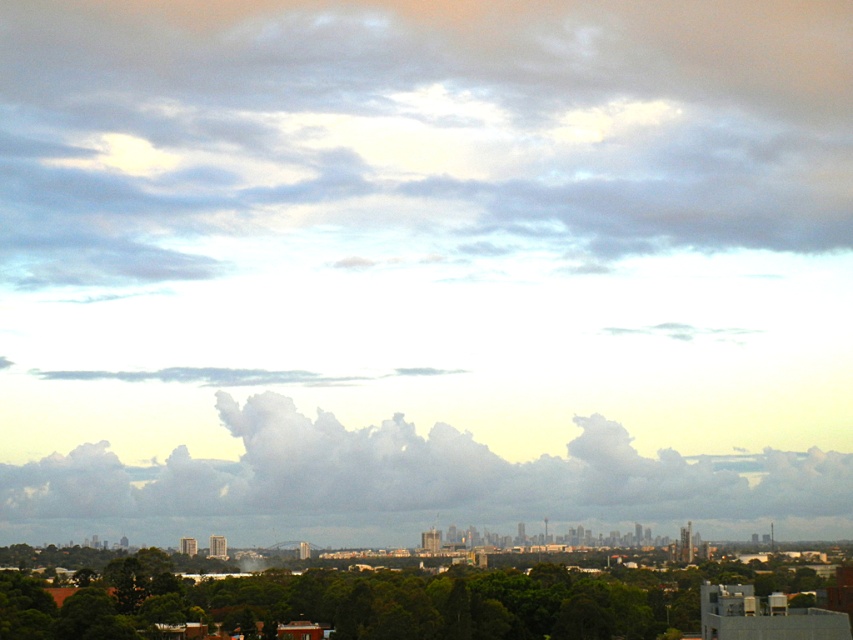
Is point (787, 120) farther from viewer compared to point (840, 493)?

No.

The image size is (853, 640). I want to click on cloudy sky at upper center, so click(x=415, y=134).

Who is positioned more to the left, white fluffy cloud at center or green leafy tree at lower center?

Positioned to the left is green leafy tree at lower center.

Is white fluffy cloud at center bigger than green leafy tree at lower center?

Indeed, white fluffy cloud at center has a larger size compared to green leafy tree at lower center.

Describe the element at coordinates (421, 476) in the screenshot. This screenshot has height=640, width=853. I see `white fluffy cloud at center` at that location.

Image resolution: width=853 pixels, height=640 pixels. Identify the location of white fluffy cloud at center. (421, 476).

Can you confirm if cloudy sky at upper center is taller than green leafy tree at lower center?

Yes.

Can you confirm if cloudy sky at upper center is positioned to the left of green leafy tree at lower center?

Indeed, cloudy sky at upper center is positioned on the left side of green leafy tree at lower center.

The image size is (853, 640). I want to click on cloudy sky at upper center, so click(415, 134).